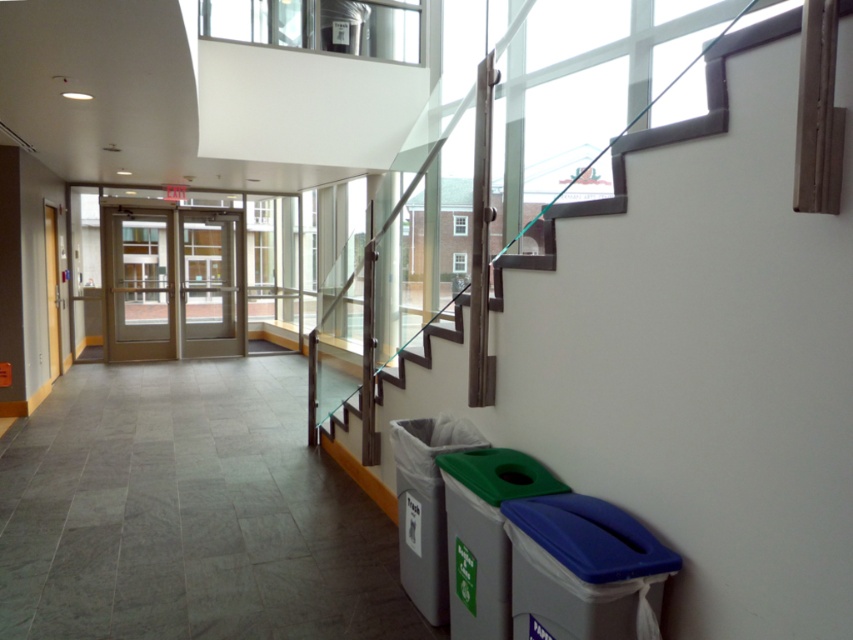
You are standing in the hallway and need to place a new small poster on the wall between the green plastic recycling bin at lower right and the gray plastic recycling bin at lower right. Considering their sizes, which bin will have more wall space available next to it for the poster?

The gray plastic recycling bin at lower right occupies more space than the green plastic recycling bin at lower right, so there will be more wall space available next to the green plastic recycling bin at lower right for placing the poster.

You are standing in the hallway and need to place a large cardboard box into one of the recycling bins. Which bin should you choose between the blue plastic recycling bin at lower right and the green plastic recycling bin at lower right?

The green plastic recycling bin at lower right is larger and can accommodate the large cardboard box since it occupies more space than the blue plastic recycling bin at lower right.